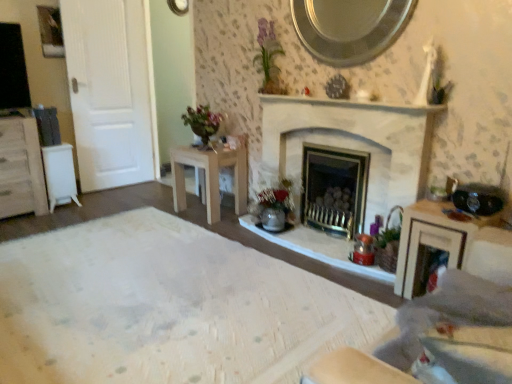
What do you see at coordinates (109, 91) in the screenshot?
I see `white matte door at left` at bounding box center [109, 91].

This screenshot has width=512, height=384. What do you see at coordinates (349, 28) in the screenshot?
I see `silver metallic mirror at upper center` at bounding box center [349, 28].

Describe the element at coordinates (352, 104) in the screenshot. Image resolution: width=512 pixels, height=384 pixels. I see `white stone fireplace at center` at that location.

What do you see at coordinates (210, 177) in the screenshot?
I see `light wood table at center, the second table positioned from the left` at bounding box center [210, 177].

Describe the element at coordinates (21, 169) in the screenshot. I see `white wood cabinet at left` at that location.

The image size is (512, 384). I want to click on white matte door at left, so click(x=109, y=91).

Is white plastic table at left, which is the first table in left-to-right order, in front of or behind wooden vanity at right in the image?

In the image, white plastic table at left, which is the first table in left-to-right order, appears behind wooden vanity at right.

Would you say white plastic table at left, the second table viewed from the right, is inside or outside wooden vanity at right?

white plastic table at left, the second table viewed from the right, is not inside wooden vanity at right, it's outside.

Is point (173, 188) closer or farther from the camera than point (68, 175)?

Clearly, point (173, 188) is closer to the camera than point (68, 175).

From the image's perspective, is light wood table at center, the second table positioned from the left, positioned above or below white plastic table at left, which is the first table in left-to-right order?

From the image's perspective, light wood table at center, the second table positioned from the left, appears below white plastic table at left, which is the first table in left-to-right order.

Based on the photo, does light wood table at center, the second table positioned from the left, appear on the left side of white plastic table at left, the second table viewed from the right?

Incorrect, light wood table at center, the second table positioned from the left, is not on the left side of white plastic table at left, the second table viewed from the right.

From a real-world perspective, between light wood table at center, the 1th table viewed from the right, and white plastic table at left, the second table viewed from the right, who is vertically lower?

white plastic table at left, the second table viewed from the right.

Considering the sizes of objects white plastic table at left, the second table viewed from the right, and white matte door at left in the image provided, who is shorter, white plastic table at left, the second table viewed from the right, or white matte door at left?

With less height is white plastic table at left, the second table viewed from the right.

Considering the relative positions of white plastic table at left, the second table viewed from the right, and white matte door at left in the image provided, is white plastic table at left, the second table viewed from the right, behind white matte door at left?

No, the depth of white plastic table at left, the second table viewed from the right, is less than that of white matte door at left.

Could you tell me if white plastic table at left, which is the first table in left-to-right order, is turned towards white matte door at left?

No, white plastic table at left, which is the first table in left-to-right order, is not oriented towards white matte door at left.

Does white plastic table at left, the second table viewed from the right, have a smaller size compared to white matte door at left?

Yes.

Which object is closer to the camera, silver metallic mirror at upper center or white matte door at left?

silver metallic mirror at upper center is in front.

Which object is positioned more to the right, silver metallic mirror at upper center or white matte door at left?

From the viewer's perspective, silver metallic mirror at upper center appears more on the right side.

What's the angular difference between silver metallic mirror at upper center and white matte door at left's facing directions?

The angular difference between silver metallic mirror at upper center and white matte door at left is 85.2 degrees.

Is silver metallic mirror at upper center taller than white matte door at left?

In fact, silver metallic mirror at upper center may be shorter than white matte door at left.

Is white stone fireplace at center positioned beyond the bounds of white stone fireplace at center?

Yes, white stone fireplace at center is located beyond the bounds of white stone fireplace at center.

Which of these two, white stone fireplace at center or white stone fireplace at center, stands shorter?

Standing shorter between the two is white stone fireplace at center.

Can you confirm if white stone fireplace at center is positioned to the right of white stone fireplace at center?

Correct, you'll find white stone fireplace at center to the right of white stone fireplace at center.

Considering the sizes of white stone fireplace at center and white stone fireplace at center in the image, is white stone fireplace at center wider or thinner than white stone fireplace at center?

In the image, white stone fireplace at center appears to be wider than white stone fireplace at center.

Does white stone fireplace at center have a lesser width compared to white matte door at left?

In fact, white stone fireplace at center might be wider than white matte door at left.

Is point (317, 134) farther from viewer compared to point (125, 178)?

No, (317, 134) is in front of (125, 178).

Based on the photo, from a real-world perspective, is white stone fireplace at center located higher than white matte door at left?

No.

From the image's perspective, between white stone fireplace at center and white matte door at left, who is located below?

white stone fireplace at center is shown below in the image.

Is point (352, 101) behind point (177, 208)?

No, it is in front of (177, 208).

From a real-world perspective, which is physically above, white stone fireplace at center or light wood table at center, the second table positioned from the left?

white stone fireplace at center, from a real-world perspective.

Between white stone fireplace at center and light wood table at center, the 1th table viewed from the right, which one has less height?

white stone fireplace at center is shorter.

Is the depth of white stone fireplace at center greater than that of light wood table at center, the second table positioned from the left?

No, white stone fireplace at center is closer to the viewer.

This screenshot has width=512, height=384. I want to click on the 2nd table behind when counting from the wooden vanity at right, so click(60, 175).

You are a GUI agent. You are given a task and a screenshot of the screen. Output one action in this format:
    pyautogui.click(x=<x>, y=<y>)
    Task: Click on the table on the right of the white plastic table at left, which is the first table in left-to-right order
    The height and width of the screenshot is (384, 512).
    Given the screenshot: What is the action you would take?
    pyautogui.click(x=210, y=177)

Considering their positions, is silver metallic mirror at upper center positioned closer to white stone fireplace at center than white wood cabinet at left?

Based on the image, silver metallic mirror at upper center appears to be nearer to white stone fireplace at center.

From the image, which object appears to be nearer to white wood cabinet at left, white stone fireplace at center or white stone fireplace at center?

Based on the image, white stone fireplace at center appears to be nearer to white wood cabinet at left.

From the image, which object appears to be nearer to white stone fireplace at center, white stone fireplace at center or wooden vanity at right?

white stone fireplace at center lies closer to white stone fireplace at center than the other object.

Based on their spatial positions, is white matte door at left or wooden vanity at right closer to white stone fireplace at center?

Among the two, wooden vanity at right is located nearer to white stone fireplace at center.

Which object lies nearer to the anchor point silver metallic mirror at upper center, white stone fireplace at center or light wood table at center, the second table positioned from the left?

The object closer to silver metallic mirror at upper center is white stone fireplace at center.

When comparing their distances from white plastic table at left, which is the first table in left-to-right order, does white wood cabinet at left or white matte door at left seem further?

The object further to white plastic table at left, which is the first table in left-to-right order, is white matte door at left.

Which object lies further to the anchor point white matte door at left, white stone fireplace at center or white plastic table at left, which is the first table in left-to-right order?

white stone fireplace at center is further to white matte door at left.

From the image, which object appears to be nearer to light wood table at center, the 1th table viewed from the right, white matte door at left or silver metallic mirror at upper center?

white matte door at left.

Identify the location of fireplace situated between light wood table at center, the second table positioned from the left, and wooden vanity at right from left to right. (354, 142).

Locate an element on the screen. The width and height of the screenshot is (512, 384). mantle between light wood table at center, the 1th table viewed from the right, and silver metallic mirror at upper center, in the horizontal direction is located at coordinates (352, 104).

Image resolution: width=512 pixels, height=384 pixels. In order to click on fireplace between white stone fireplace at center and wooden vanity at right vertically in this screenshot , I will do `click(354, 142)`.

Where is `cabinetry between white matte door at left and white plastic table at left, which is the first table in left-to-right order, in the up-down direction`? The height and width of the screenshot is (384, 512). cabinetry between white matte door at left and white plastic table at left, which is the first table in left-to-right order, in the up-down direction is located at coordinates (21, 169).